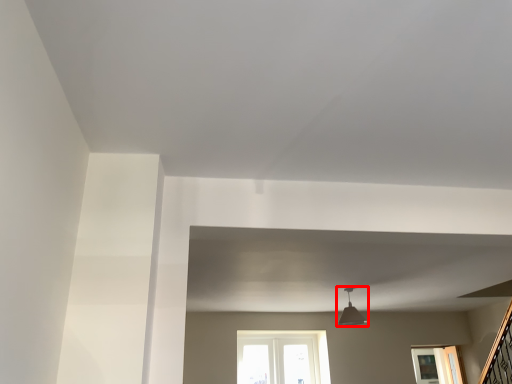
Question: From the image's perspective, what is the correct spatial relationship of light fixture (annotated by the red box) in relation to window?

Choices:
 (A) below
 (B) above

Answer: (B)